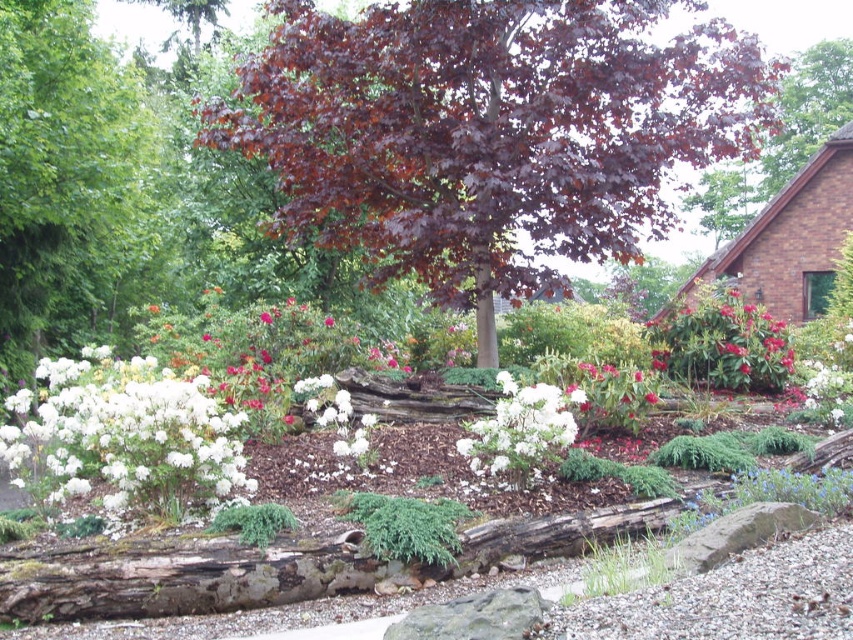
You are a gardener planning to plant a new bush in this garden. You have two white fluffy bushes to choose from. The first one is the white fluffy bush at lower left, and the second one is the white fluffy bush at center. Which one is bigger?

The white fluffy bush at lower left is larger in size than the white fluffy bush at center.

You are a gardener planning to transplant the white fluffy bush at lower left and the white fluffy bush at center to a new garden bed. Which of the two bushes requires a wider space to accommodate its current width?

The white fluffy bush at lower left requires a wider space because its width is larger than the white fluffy bush at center.

You are standing in the garden scene described. You want to place a small statue exactly at the point marked by the coordinates point (722, 342). What object will the statue be placed next to?

The point (722, 342) marks the red glossy flower at center right, so the statue will be placed next to the red glossy flower at center right.